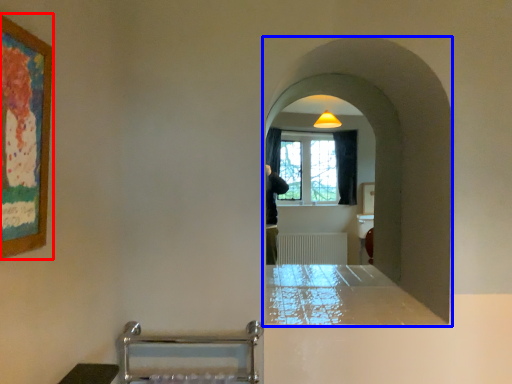
Question: Which of the following is the farthest to the observer, picture frame (highlighted by a red box) or passage (highlighted by a blue box)?

Choices:
 (A) picture frame
 (B) passage

Answer: (B)